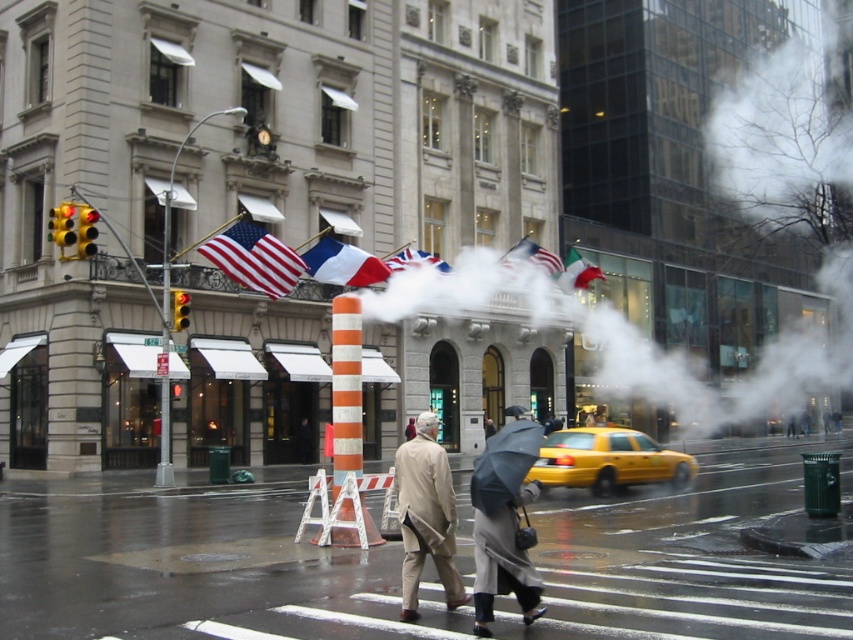
Measure the distance from white steam at center to matte fabric flag at upper center.

white steam at center and matte fabric flag at upper center are 17.38 meters apart from each other.

Is point (666, 248) farther from viewer compared to point (257, 228)?

Yes.

Find the location of a particular element. This screenshot has width=853, height=640. white steam at center is located at coordinates (720, 209).

In the scene shown: Can you confirm if white steam at center is smaller than yellow rubber taxi at center?

No, white steam at center is not smaller than yellow rubber taxi at center.

Does point (624, 390) lie in front of point (643, 460)?

No, it is not.

What are the coordinates of `white steam at center` in the screenshot? It's located at (720, 209).

Is dark gray wool coat at center thinner than white plastic traffic cone at center?

Yes, dark gray wool coat at center is thinner than white plastic traffic cone at center.

Is dark gray wool coat at center bigger than white plastic traffic cone at center?

No.

Between point (473, 520) and point (354, 477), which one is positioned behind?

The point (473, 520) is more distant.

You are a GUI agent. You are given a task and a screenshot of the screen. Output one action in this format:
    pyautogui.click(x=<x>, y=<y>)
    Task: Click on the dark gray wool coat at center
    
    Given the screenshot: What is the action you would take?
    pyautogui.click(x=503, y=563)